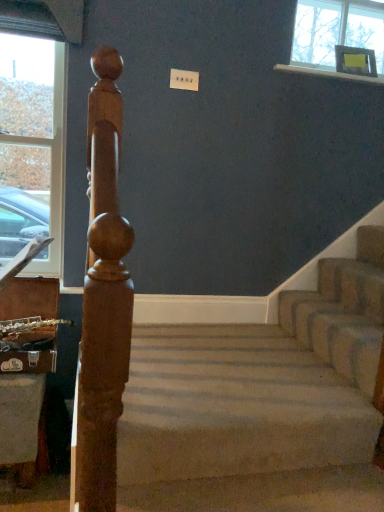
Question: Does white glossy window sill at upper right have a greater height compared to beige carpeted stairs at center?

Choices:
 (A) yes
 (B) no

Answer: (B)

Question: Is white glossy window sill at upper right smaller than beige carpeted stairs at center?

Choices:
 (A) yes
 (B) no

Answer: (A)

Question: Can we say white glossy window sill at upper right lies outside beige carpeted stairs at center?

Choices:
 (A) no
 (B) yes

Answer: (B)

Question: From a real-world perspective, is white glossy window sill at upper right over beige carpeted stairs at center?

Choices:
 (A) yes
 (B) no

Answer: (A)

Question: Does white glossy window sill at upper right touch beige carpeted stairs at center?

Choices:
 (A) yes
 (B) no

Answer: (B)

Question: Visually, is carpeted stairs at center positioned to the left or to the right of beige carpeted stairs at center?

Choices:
 (A) left
 (B) right

Answer: (B)

Question: Looking at their shapes, would you say carpeted stairs at center is wider or thinner than beige carpeted stairs at center?

Choices:
 (A) thin
 (B) wide

Answer: (A)

Question: From the image's perspective, is carpeted stairs at center positioned above or below beige carpeted stairs at center?

Choices:
 (A) above
 (B) below

Answer: (A)

Question: From a real-world perspective, is carpeted stairs at center positioned above or below beige carpeted stairs at center?

Choices:
 (A) below
 (B) above

Answer: (B)

Question: From a real-world perspective, is white glossy window sill at upper right physically located above or below clear glass window at left?

Choices:
 (A) above
 (B) below

Answer: (A)

Question: Which is correct: white glossy window sill at upper right is inside clear glass window at left, or outside of it?

Choices:
 (A) inside
 (B) outside

Answer: (B)

Question: Does point (334, 69) appear closer or farther from the camera than point (11, 46)?

Choices:
 (A) farther
 (B) closer

Answer: (A)

Question: In the image, is white glossy window sill at upper right on the left side or the right side of clear glass window at left?

Choices:
 (A) right
 (B) left

Answer: (A)

Question: Considering the positions of carpeted stairs at center and white glossy window sill at upper right in the image, is carpeted stairs at center bigger or smaller than white glossy window sill at upper right?

Choices:
 (A) big
 (B) small

Answer: (A)

Question: Is carpeted stairs at center inside or outside of white glossy window sill at upper right?

Choices:
 (A) outside
 (B) inside

Answer: (A)